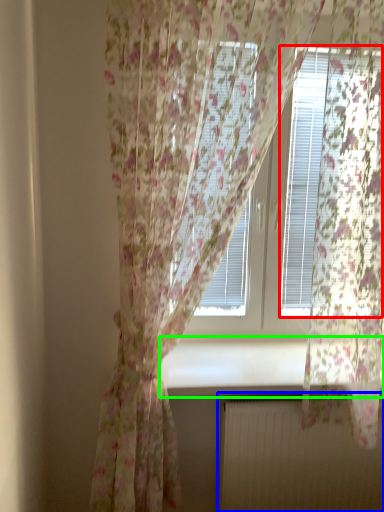
Question: Which is farther away from blind (highlighted by a red box)? radiator (highlighted by a blue box) or window sill (highlighted by a green box)?

Choices:
 (A) radiator
 (B) window sill

Answer: (A)